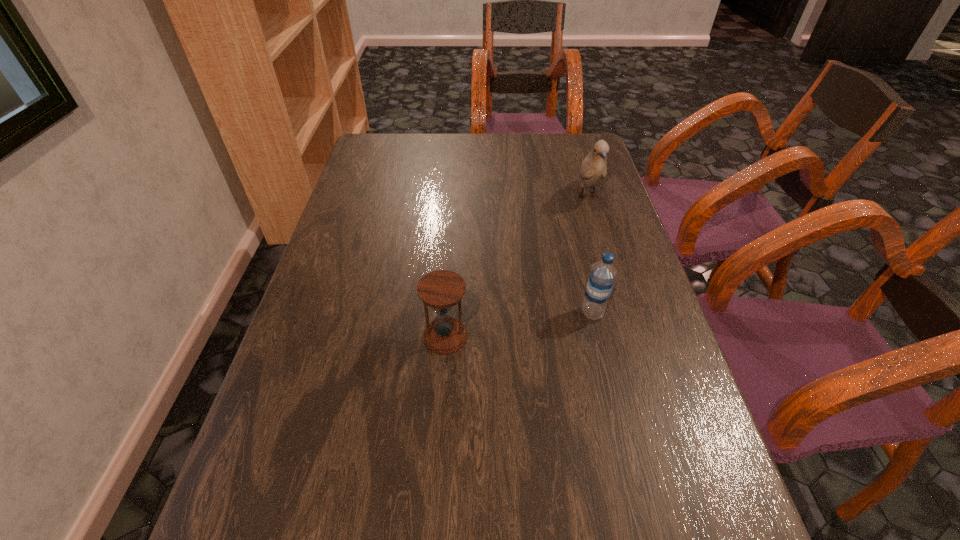
The height and width of the screenshot is (540, 960). Find the location of `empty location between the rightmost object and the water bottle`. empty location between the rightmost object and the water bottle is located at coordinates (x=590, y=255).

This screenshot has width=960, height=540. Identify the location of free space between the second object from left to right and the leftmost object. [x=519, y=325].

The image size is (960, 540). I want to click on the second closest object to the leftmost object, so click(x=593, y=168).

Where is `object identified as the closest to the leftmost object`? object identified as the closest to the leftmost object is located at coordinates (602, 276).